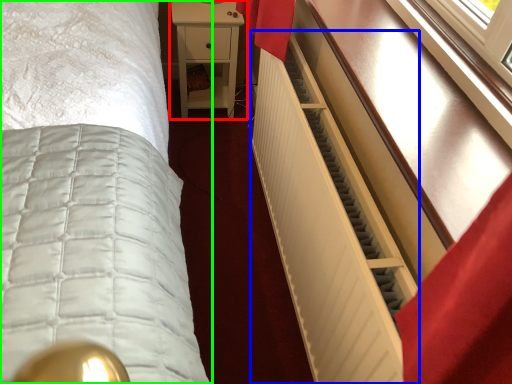
Question: Estimate the real-world distances between objects in this image. Which object is farther from nightstand (highlighted by a red box), radiator (highlighted by a blue box) or bed (highlighted by a green box)?

Choices:
 (A) radiator
 (B) bed

Answer: (A)